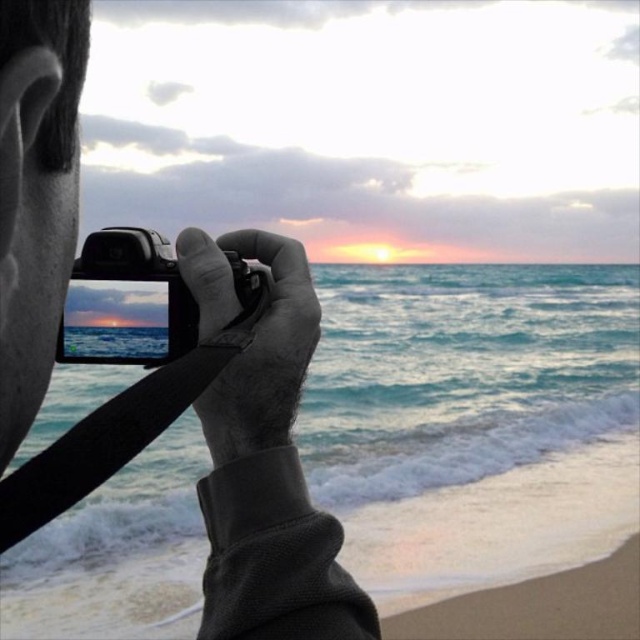
You are standing on the sandy beach at lower right and want to take a photo of the sunset using the black plastic camera at center. Can you reach the camera without moving from your current position?

The sandy beach at lower right is below the black plastic camera at center, so you can reach the camera without moving from your current position since it is above you.

You are a photographer trying to capture the sunset. You have a black plastic camera at center and a sandy beach at lower right in your viewfinder. Which object is closer to you, the photographer?

The sandy beach at lower right is closer to you because the black plastic camera at center is behind it.

You are a photographer trying to capture the sunset. You have a matte black camera at center and a sandy beach at lower right in your view. Where should you position yourself to ensure both the camera and the beach are in the frame?

You should position yourself so that the matte black camera at center is above the sandy beach at lower right, ensuring both elements are visible in the frame.